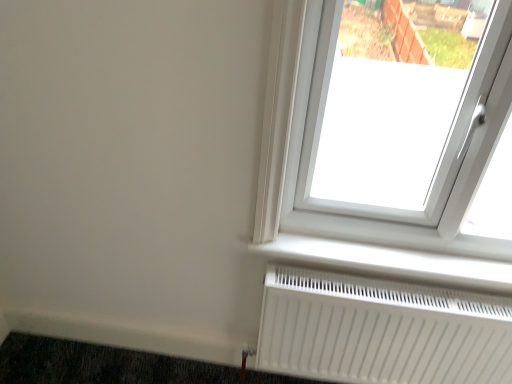
Question: Is dark gray carpet at lower left positioned behind white plastic radiator at lower center?

Choices:
 (A) yes
 (B) no

Answer: (A)

Question: From the image's perspective, is dark gray carpet at lower left located above white plastic radiator at lower center?

Choices:
 (A) no
 (B) yes

Answer: (A)

Question: Would you consider dark gray carpet at lower left to be distant from white plastic radiator at lower center?

Choices:
 (A) no
 (B) yes

Answer: (A)

Question: Is dark gray carpet at lower left taller than white plastic radiator at lower center?

Choices:
 (A) no
 (B) yes

Answer: (B)

Question: Can you confirm if dark gray carpet at lower left is positioned to the right of white plastic radiator at lower center?

Choices:
 (A) yes
 (B) no

Answer: (B)

Question: Is white plastic radiator at lower center a part of dark gray carpet at lower left?

Choices:
 (A) no
 (B) yes

Answer: (A)

Question: Does white matte radiator at lower right have a lesser height compared to dark gray carpet at lower left?

Choices:
 (A) yes
 (B) no

Answer: (B)

Question: Is white matte radiator at lower right smaller than dark gray carpet at lower left?

Choices:
 (A) no
 (B) yes

Answer: (A)

Question: Is white matte radiator at lower right at the right side of dark gray carpet at lower left?

Choices:
 (A) yes
 (B) no

Answer: (A)

Question: Is white matte radiator at lower right touching dark gray carpet at lower left?

Choices:
 (A) yes
 (B) no

Answer: (B)

Question: Is white matte radiator at lower right turned away from dark gray carpet at lower left?

Choices:
 (A) no
 (B) yes

Answer: (A)

Question: From the image's perspective, is white matte radiator at lower right beneath dark gray carpet at lower left?

Choices:
 (A) no
 (B) yes

Answer: (A)

Question: From a real-world perspective, is white plastic radiator at lower center physically above white matte radiator at lower right?

Choices:
 (A) no
 (B) yes

Answer: (B)